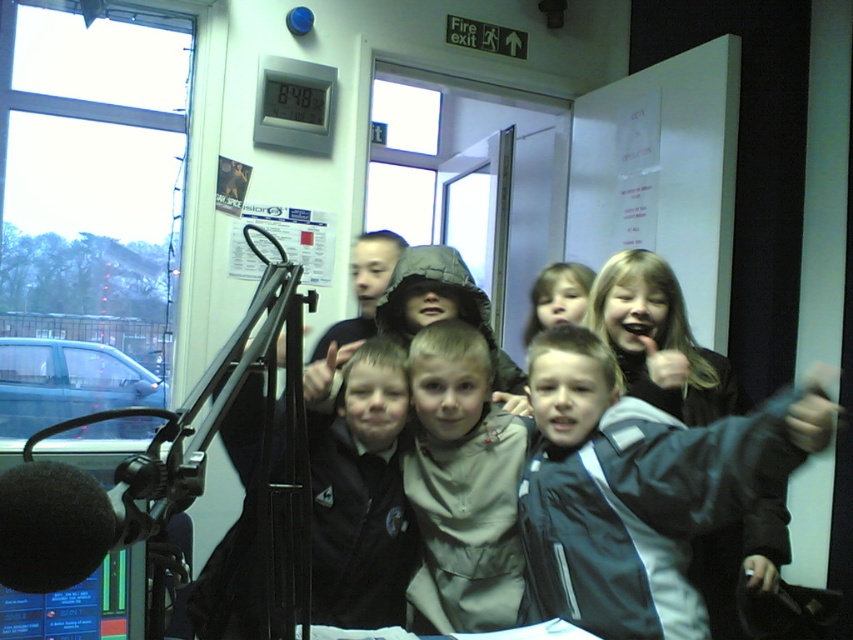
Question: Which point appears farthest from the camera in this image?

Choices:
 (A) (527, 390)
 (B) (450, 481)
 (C) (581, 310)

Answer: (C)

Question: Does light brown fabric jacket at center appear on the left side of black foam microphone at lower left?

Choices:
 (A) yes
 (B) no

Answer: (B)

Question: Estimate the real-world distances between objects in this image. Which object is closer to the black foam microphone at lower left?

Choices:
 (A) smooth beige jacket at center
 (B) dark blue jacket at center

Answer: (B)

Question: Does dark blue jacket at center appear on the right side of light brown fabric jacket at center?

Choices:
 (A) yes
 (B) no

Answer: (A)

Question: Which object is the closest to the black foam microphone at lower left?

Choices:
 (A) dark blue jacket at center
 (B) light brown fabric jacket at center
 (C) smooth beige jacket at center

Answer: (A)

Question: Does dark blue jacket at center lie in front of light brown fabric jacket at center?

Choices:
 (A) no
 (B) yes

Answer: (B)